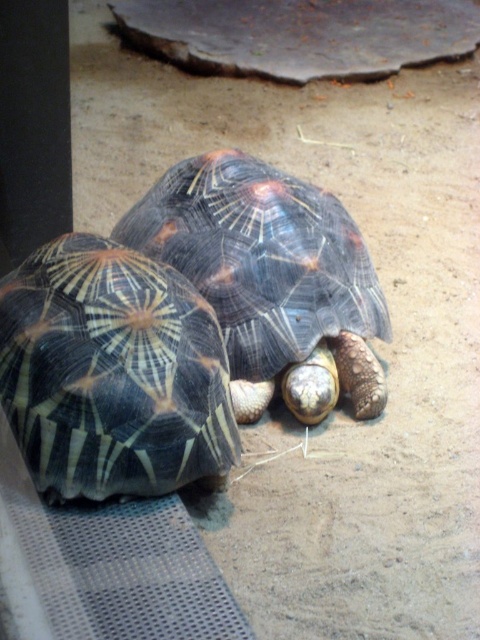
Question: In this image, where is shiny black tortoise at center located relative to shiny dark tortoise at center?

Choices:
 (A) right
 (B) left

Answer: (B)

Question: From the image, what is the correct spatial relationship of shiny black tortoise at center in relation to shiny dark tortoise at center?

Choices:
 (A) left
 (B) right

Answer: (A)

Question: Among these objects, which one is farthest from the camera?

Choices:
 (A) shiny dark tortoise at center
 (B) shiny black tortoise at center

Answer: (A)

Question: Does shiny black tortoise at center have a larger size compared to shiny dark tortoise at center?

Choices:
 (A) yes
 (B) no

Answer: (B)